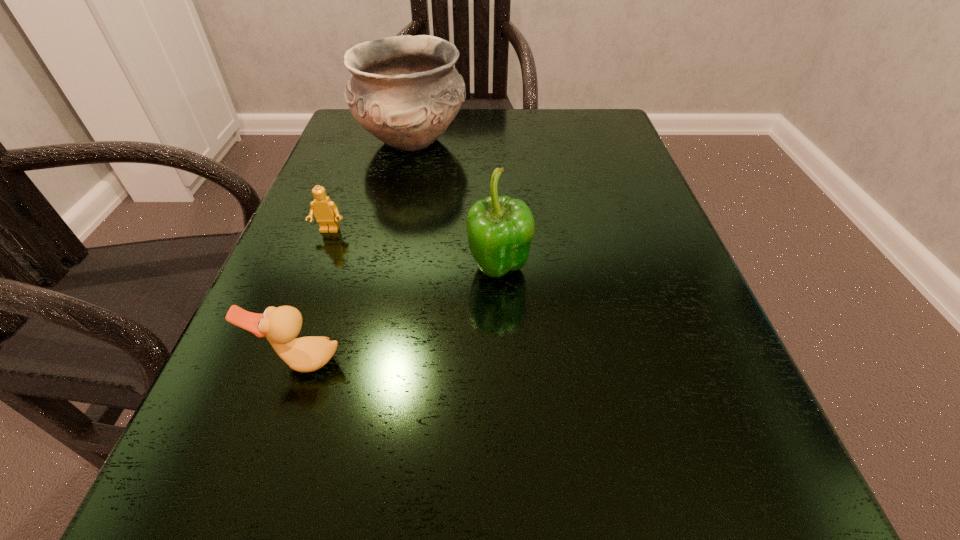
I want to click on free region at the far right corner of the desktop, so click(x=560, y=145).

Locate an element on the screen. vacant area that lies between the nearest object and the third nearest object is located at coordinates [x=315, y=296].

This screenshot has width=960, height=540. Find the location of `vacant space that's between the nearest object and the pottery`. vacant space that's between the nearest object and the pottery is located at coordinates (356, 252).

Locate an element on the screen. This screenshot has width=960, height=540. vacant area that lies between the second tallest object and the Lego is located at coordinates (414, 250).

Identify the location of free space between the nearest object and the Lego. This screenshot has height=540, width=960. (315, 296).

The height and width of the screenshot is (540, 960). Identify the location of free space between the pottery and the Lego. (371, 186).

Where is `unoccupied position between the duck and the second nearest object`? Image resolution: width=960 pixels, height=540 pixels. unoccupied position between the duck and the second nearest object is located at coordinates (399, 316).

The height and width of the screenshot is (540, 960). I want to click on vacant space that is in between the bell pepper and the Lego, so click(414, 250).

Where is `free space between the third shortest object and the nearest object`? free space between the third shortest object and the nearest object is located at coordinates (399, 316).

Identify the location of unoccupied area between the farthest object and the third nearest object. (371, 186).